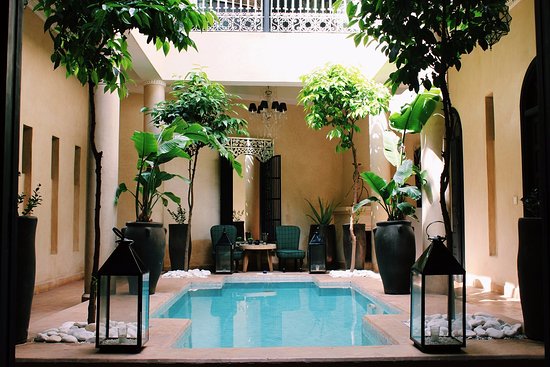
Locate an element on the screen. right green chair beside stool is located at coordinates (291, 241).